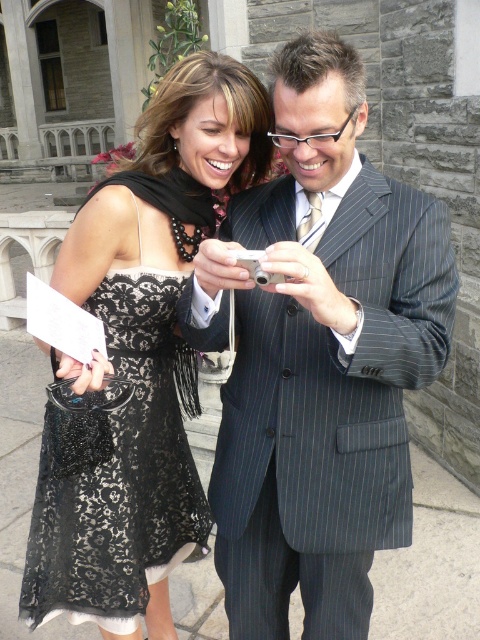
Question: Can you confirm if pinstriped suit at center is positioned below black lace dress at center?

Choices:
 (A) yes
 (B) no

Answer: (B)

Question: Among these points, which one is nearest to the camera?

Choices:
 (A) (361, 161)
 (B) (176, 236)

Answer: (A)

Question: Does pinstriped suit at center appear under black lace dress at center?

Choices:
 (A) no
 (B) yes

Answer: (A)

Question: Is pinstriped suit at center closer to the viewer compared to black lace dress at center?

Choices:
 (A) yes
 (B) no

Answer: (A)